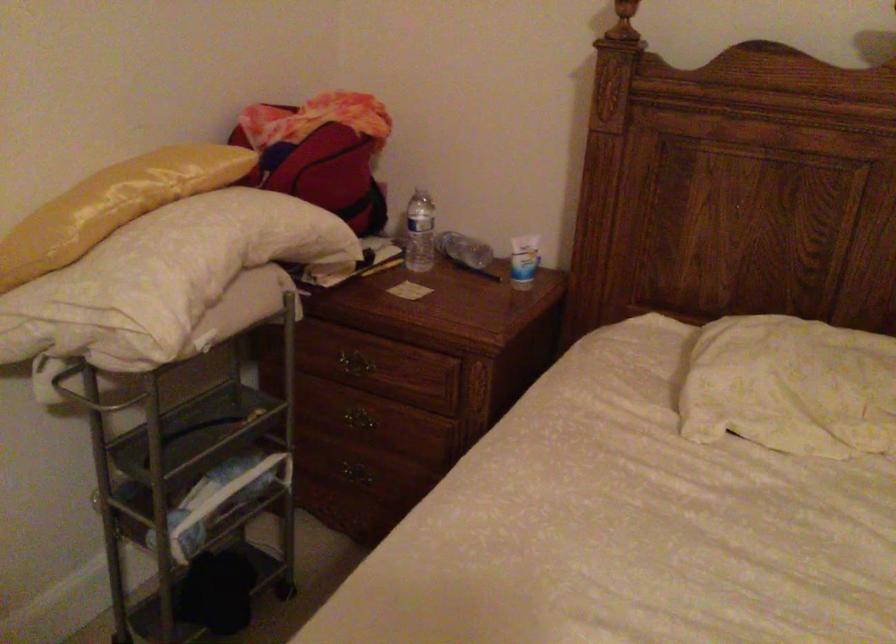
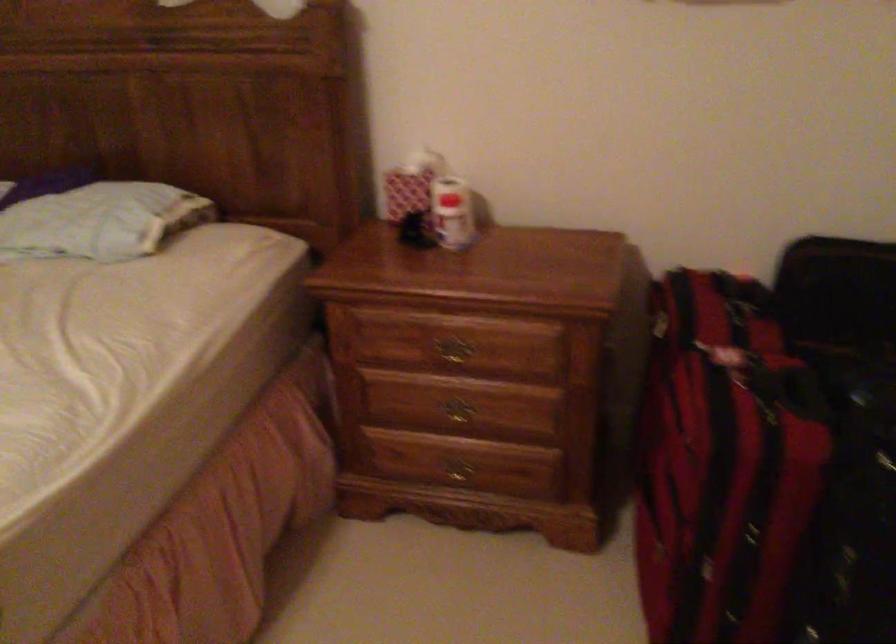
What movement of the cameraman would produce the second image?

The cameraman walked toward right, backward.